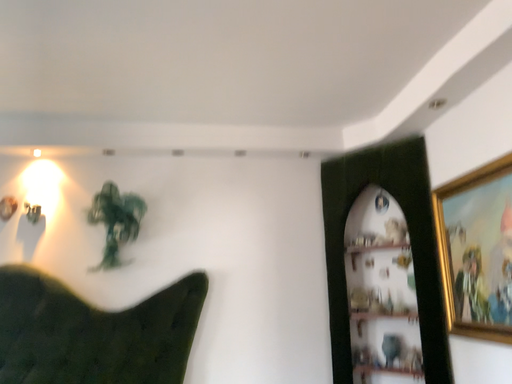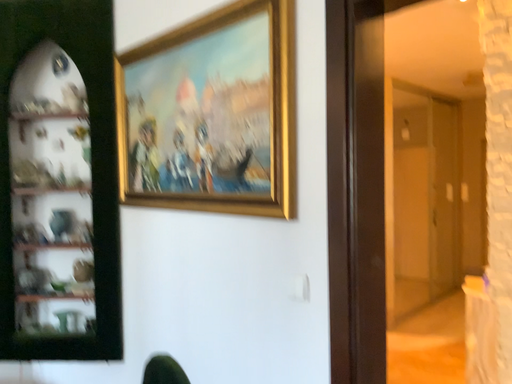
Question: How did the camera likely rotate when shooting the video?

Choices:
 (A) rotated left
 (B) rotated right

Answer: (B)